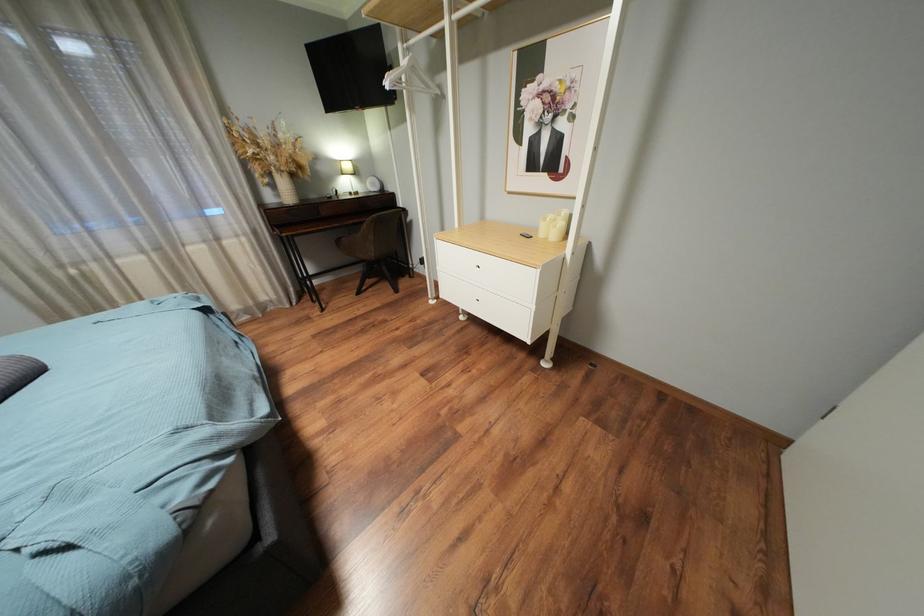
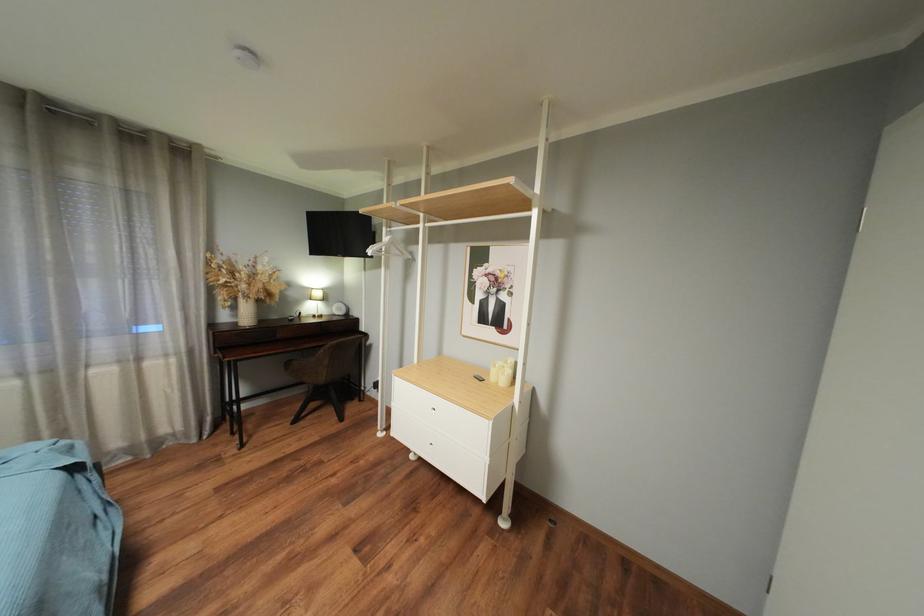
Question: Based on the continuous images, in which direction is the camera rotating? Reply with the corresponding letter.

Choices:
 (A) Left
 (B) Right
 (C) Up
 (D) Down

Answer: (C)